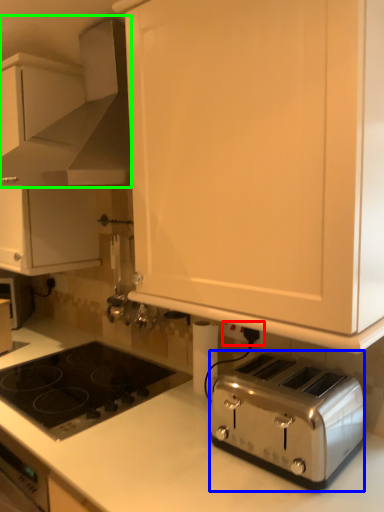
Question: Considering the real-world distances, which object is farthest from electric outlet (highlighted by a red box)? toaster (highlighted by a blue box) or home appliance (highlighted by a green box)?

Choices:
 (A) toaster
 (B) home appliance

Answer: (B)